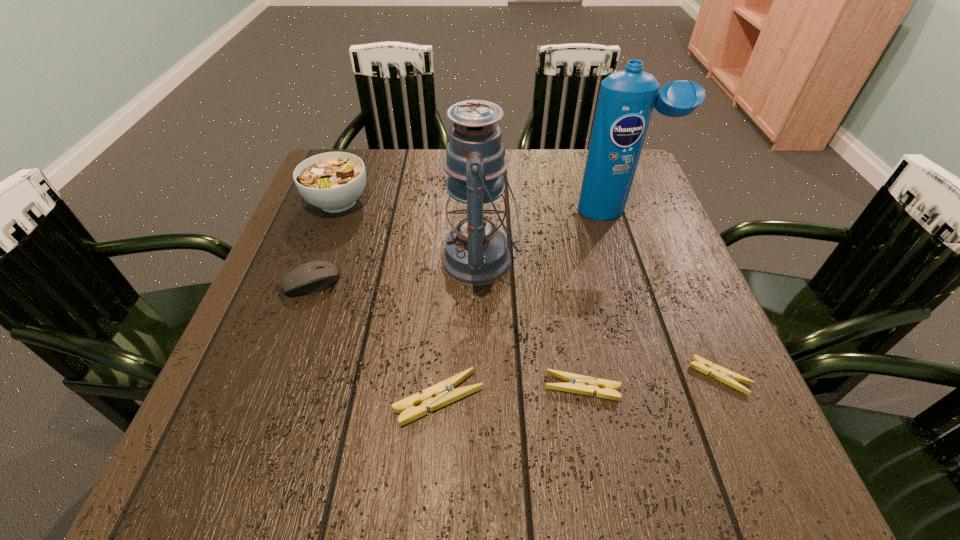
Select which clothespin is the second closest to the second shortest object. Please provide its 2D coordinates. Your answer should be formatted as a tuple, i.e. [(x, y)], where the tuple contains the x and y coordinates of a point satisfying the conditions above.

[(728, 377)]

The width and height of the screenshot is (960, 540). In order to click on clothespin that stands as the second closest to the lantern in this screenshot , I will do `click(579, 384)`.

Where is `free point that satisfies the following two spatial constraints: 1. on the front side of the soup bowl; 2. on the right side of the fourth shortest object`? The height and width of the screenshot is (540, 960). free point that satisfies the following two spatial constraints: 1. on the front side of the soup bowl; 2. on the right side of the fourth shortest object is located at coordinates (308, 282).

In order to click on free space that satisfies the following two spatial constraints: 1. on the front-facing side of the lantern; 2. on the back side of the shortest clothespin in this screenshot , I will do [481, 376].